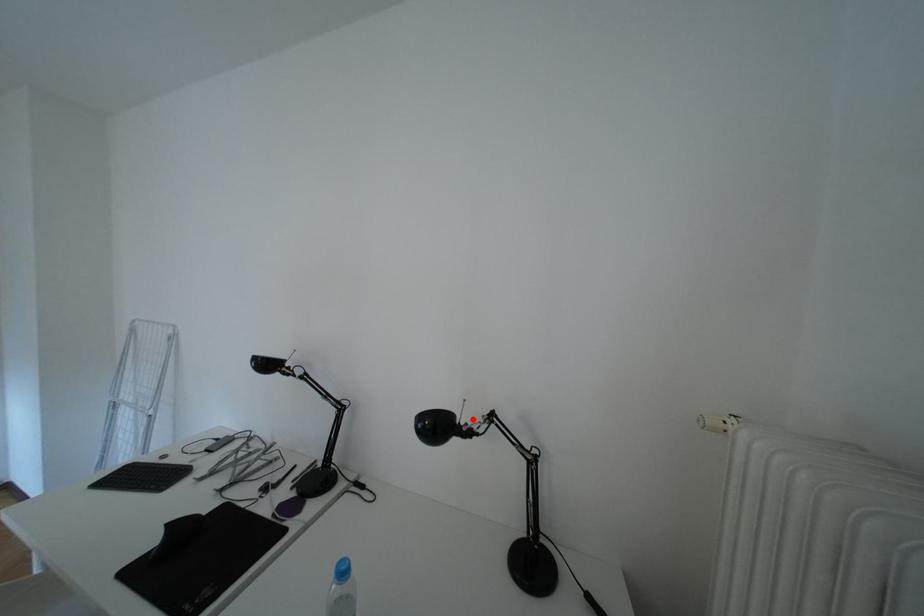
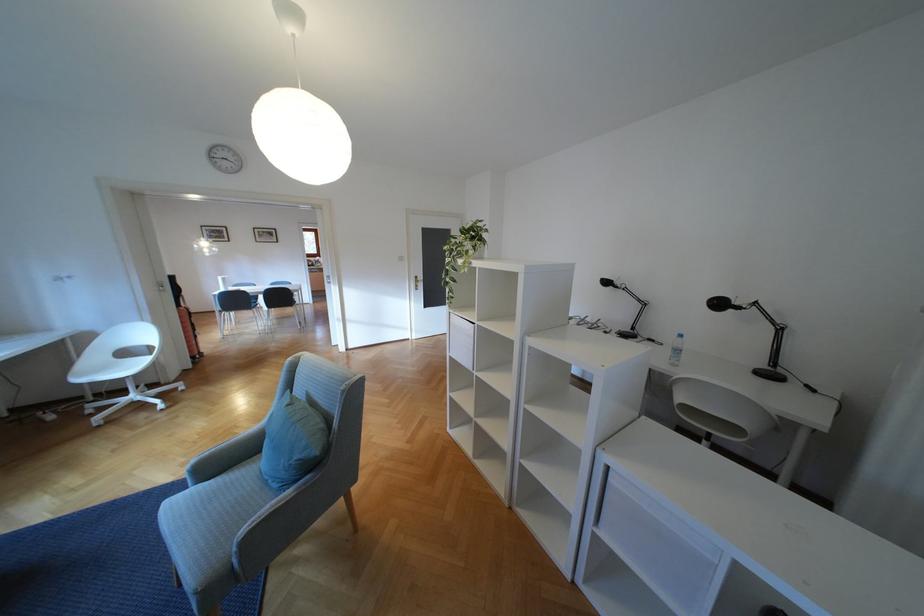
Where in the second image is the point corresponding to the highlighted location from the first image?

(746, 302)